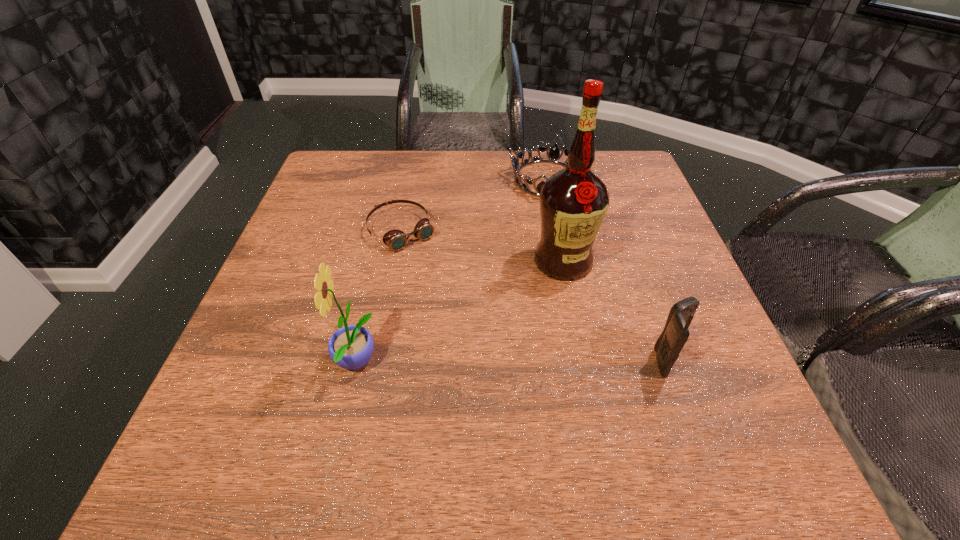
Image resolution: width=960 pixels, height=540 pixels. In order to click on free spot at the right edge of the desktop in this screenshot , I will do `click(618, 287)`.

Find the location of a particular element. This screenshot has width=960, height=540. vacant space at the far left corner of the desktop is located at coordinates (341, 159).

In the image, there is a desktop. Where is `free space at the near left corner`? free space at the near left corner is located at coordinates (291, 417).

Find the location of a particular element. This screenshot has width=960, height=540. vacant space at the far right corner is located at coordinates (604, 180).

In the image, there is a desktop. Where is `free region at the near right corner`? The image size is (960, 540). free region at the near right corner is located at coordinates (656, 387).

Locate an element on the screen. The height and width of the screenshot is (540, 960). free space between the sunflower and the second shortest object is located at coordinates (451, 271).

At what (x,y) coordinates should I click in order to perform the action: click on free space between the tallest object and the sunflower. Please return your answer as a coordinate pair (x, y). Image resolution: width=960 pixels, height=540 pixels. Looking at the image, I should click on (459, 313).

I want to click on empty space that is in between the goggles and the cellular telephone, so click(x=534, y=296).

At what (x,y) coordinates should I click in order to perform the action: click on free point between the goggles and the fourth shortest object. Please return your answer as a coordinate pair (x, y). The width and height of the screenshot is (960, 540). Looking at the image, I should click on click(x=378, y=297).

Where is `vacant area that lies between the tallest object and the second tallest object`? vacant area that lies between the tallest object and the second tallest object is located at coordinates (459, 313).